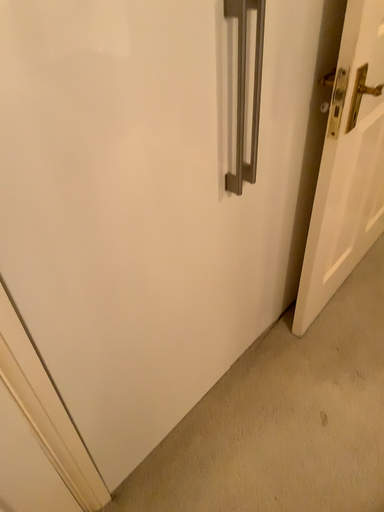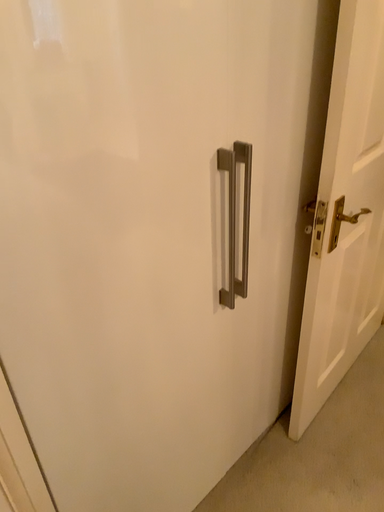
Question: How did the camera likely rotate when shooting the video?

Choices:
 (A) rotated upward
 (B) rotated downward

Answer: (A)